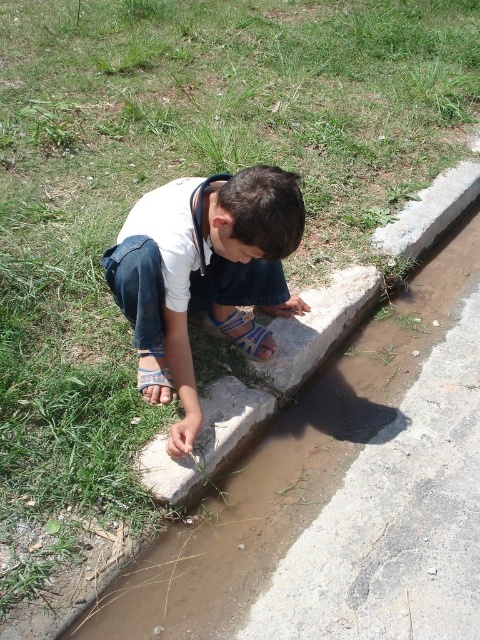
The boy is wearing a white cotton shirt at center and denim at left. Which clothing item has a larger surface area?

The white cotton shirt at center has a larger surface area than the denim at left, as it is bigger.

Based on the scene description, where is the white cotton shirt at center located in terms of coordinates?

The white cotton shirt at center is located at coordinates point (204, 275).

You are standing at the point marked as point (251,346) in the image. You want to throw a small stone into the water channel shown in the scene. Considering your current position, can you reach the water channel easily?

The point (251,346) is 2.38 meters away from the viewer. Since the distance is relatively short, you can easily reach the water channel from your current position to throw a stone.